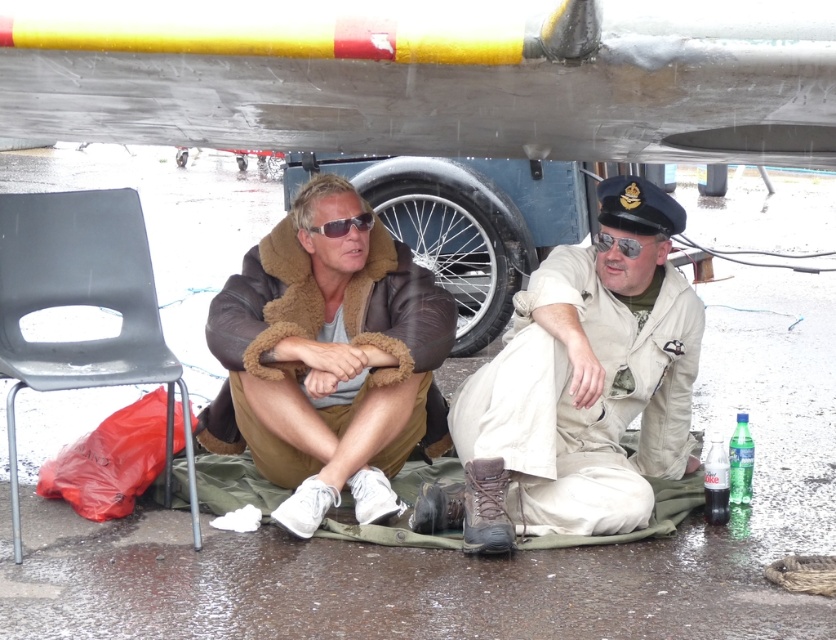
Question: Does brown shearling jacket at center have a greater width compared to matte brown aviator goggles at center?

Choices:
 (A) yes
 (B) no

Answer: (A)

Question: Can you confirm if metallic gray wing at upper center is smaller than metallic silver tire at center?

Choices:
 (A) yes
 (B) no

Answer: (B)

Question: Which object is the closest to the metallic silver tire at center?

Choices:
 (A) black plastic chair at lower left
 (B) metallic gray wing at upper center
 (C) khaki fabric uniform at lower center

Answer: (C)

Question: Which of the following is the closest to the observer?

Choices:
 (A) metallic gray wing at upper center
 (B) brown shearling jacket at center

Answer: (A)

Question: Is the position of brown shearling jacket at center less distant than that of metallic silver tire at center?

Choices:
 (A) yes
 (B) no

Answer: (A)

Question: Among these points, which one is farthest from the camera?

Choices:
 (A) (564, 467)
 (B) (831, 113)
 (C) (255, 413)
 (D) (324, 236)

Answer: (D)